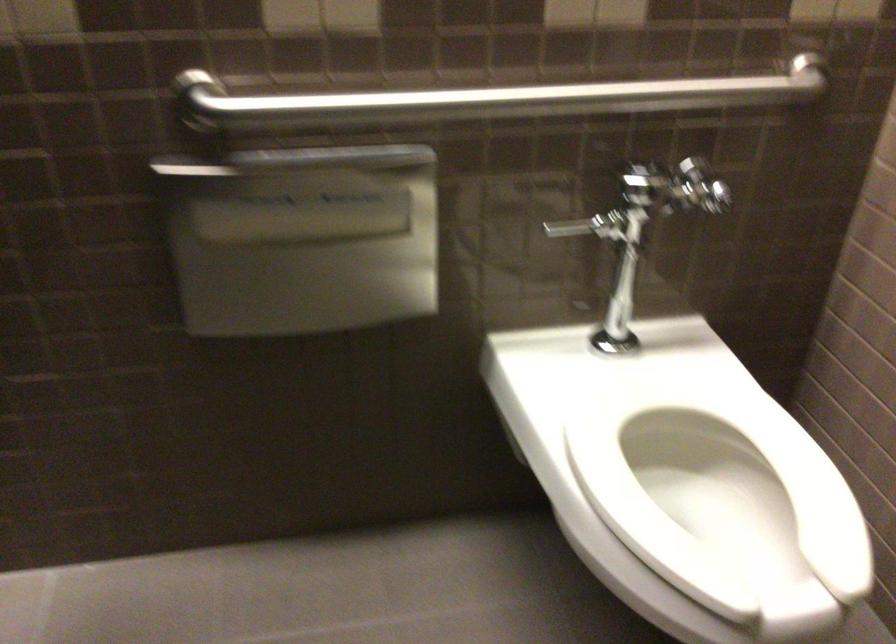
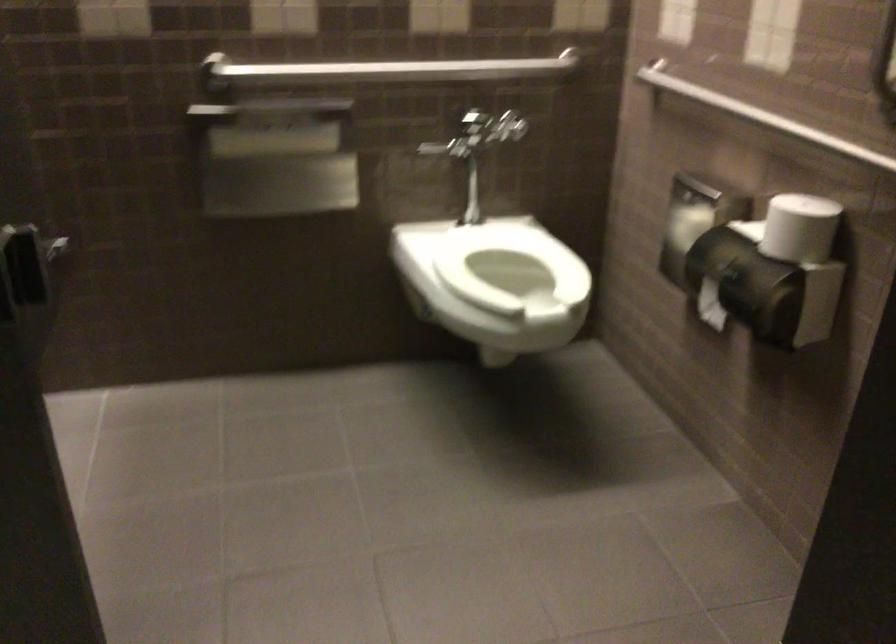
Question: The camera is either moving clockwise (left) or counter-clockwise (right) around the object. The first image is from the beginning of the video and the second image is from the end. Is the camera moving left or right when shooting the video?

Choices:
 (A) Left
 (B) Right

Answer: (A)